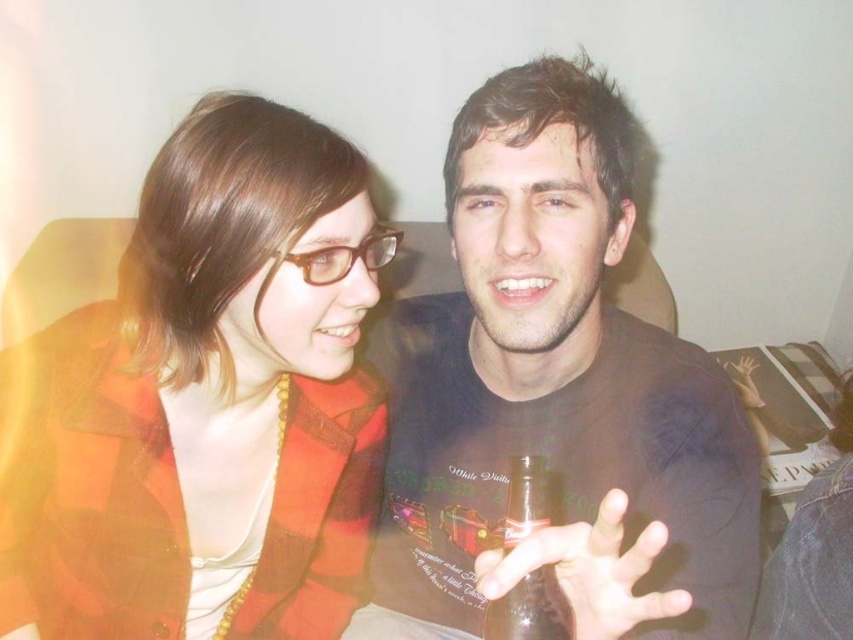
Who is more forward, (x=625, y=224) or (x=506, y=596)?

Positioned in front is point (x=506, y=596).

Is matte black t-shirt at center closer to the viewer compared to translucent glass bottle at center?

No, matte black t-shirt at center is behind translucent glass bottle at center.

Who is more distant from viewer, (447, 588) or (535, 499)?

The point (447, 588) is behind.

The width and height of the screenshot is (853, 640). Find the location of `matte black t-shirt at center`. matte black t-shirt at center is located at coordinates (555, 374).

Based on the photo, between plaid fabric jacket at left and matte black t-shirt at center, which one has more height?

With more height is matte black t-shirt at center.

Which is behind, point (271, 561) or point (602, 84)?

Point (271, 561)

The height and width of the screenshot is (640, 853). Identify the location of plaid fabric jacket at left. (204, 396).

Does plaid fabric jacket at left have a smaller size compared to translucent glass bottle at center?

No, plaid fabric jacket at left is not smaller than translucent glass bottle at center.

Who is shorter, plaid fabric jacket at left or translucent glass bottle at center?

translucent glass bottle at center is shorter.

This screenshot has height=640, width=853. Describe the element at coordinates (204, 396) in the screenshot. I see `plaid fabric jacket at left` at that location.

Locate an element on the screen. This screenshot has width=853, height=640. plaid fabric jacket at left is located at coordinates (204, 396).